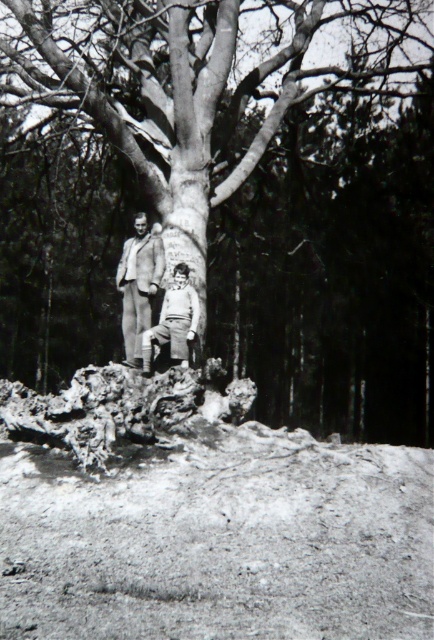
You are a photographer trying to capture both the smooth bark tree trunk at center and the dull brown dirt at lower center in a single frame. Considering their sizes, which object should you focus on to ensure both are visible without zooming in or out?

The smooth bark tree trunk at center is larger in size than the dull brown dirt at lower center, so you should focus on the smooth bark tree trunk at center to ensure both are visible without adjusting the zoom.

You are a photographer trying to capture a photo of the smooth bark tree trunk at center and the dull brown dirt at lower center. Which object should you focus on first if you want to ensure both are in sharp focus?

The smooth bark tree trunk at center is taller than the dull brown dirt at lower center, so you should focus on the smooth bark tree trunk at center first to ensure both are in sharp focus.

You are standing at the center of the forest clearing and want to locate the smooth bark tree trunk at center. Based on the coordinates provided, in which direction should you move to find it?

The smooth bark tree trunk at center is located at coordinates point (x=229, y=193). Since you are at the center of the clearing, you should move towards the direction of the coordinates to find it.